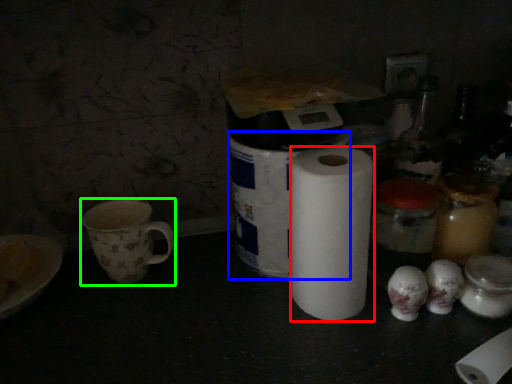
Question: Which is nearer to the paper towel (highlighted by a red box)? toilet paper (highlighted by a blue box) or coffee cup (highlighted by a green box).

Choices:
 (A) toilet paper
 (B) coffee cup

Answer: (A)